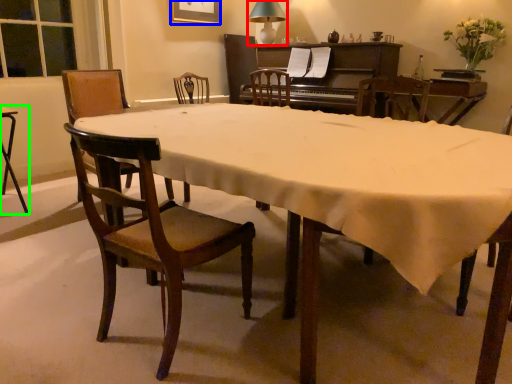
Question: Estimate the real-world distances between objects in this image. Which object is closer to lamp (highlighted by a red box), picture frame (highlighted by a blue box) or desk (highlighted by a green box)?

Choices:
 (A) picture frame
 (B) desk

Answer: (A)